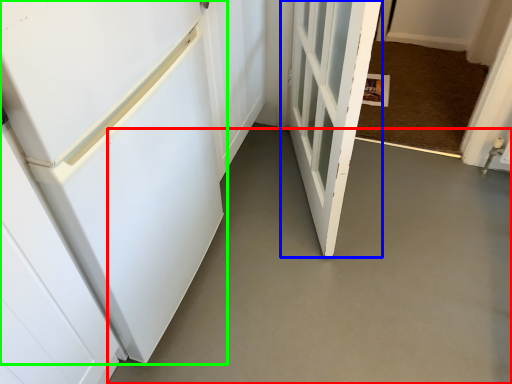
Question: Which is nearer to the concrete (highlighted by a red box)? door (highlighted by a blue box) or door (highlighted by a green box).

Choices:
 (A) door
 (B) door

Answer: (A)